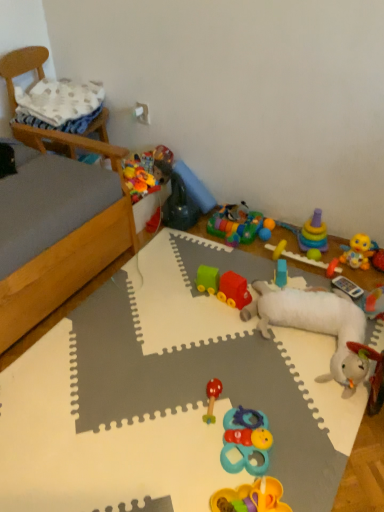
Question: Is white plush sheep at center, the 8th toy viewed from the top, at the back of rubberized plastic train at center, which is counted as the 4th toy, starting from the bottom?

Choices:
 (A) yes
 (B) no

Answer: (B)

Question: Is rubberized plastic train at center, the 7th toy when ordered from top to bottom, oriented towards white plush sheep at center, the third toy ordered from the bottom?

Choices:
 (A) no
 (B) yes

Answer: (B)

Question: Considering the relative sizes of rubberized plastic train at center, which is counted as the 4th toy, starting from the bottom, and white plush sheep at center, the 8th toy viewed from the top, in the image provided, is rubberized plastic train at center, which is counted as the 4th toy, starting from the bottom, smaller than white plush sheep at center, the 8th toy viewed from the top,?

Choices:
 (A) yes
 (B) no

Answer: (A)

Question: Is rubberized plastic train at center, which is counted as the 4th toy, starting from the bottom, to the left of white plush sheep at center, the third toy ordered from the bottom, from the viewer's perspective?

Choices:
 (A) no
 (B) yes

Answer: (B)

Question: Is rubberized plastic train at center, the 7th toy when ordered from top to bottom, far from white plush sheep at center, the 8th toy viewed from the top?

Choices:
 (A) no
 (B) yes

Answer: (A)

Question: In terms of height, does green rubber ball at upper right, arranged as the 7th toy when ordered from the bottom, look taller or shorter compared to wooden bed frame at left?

Choices:
 (A) short
 (B) tall

Answer: (A)

Question: Considering their positions, is green rubber ball at upper right, arranged as the 7th toy when ordered from the bottom, located in front of or behind wooden bed frame at left?

Choices:
 (A) behind
 (B) front

Answer: (A)

Question: From a real-world perspective, relative to wooden bed frame at left, is green rubber ball at upper right, the fourth toy from the top, vertically above or below?

Choices:
 (A) above
 (B) below

Answer: (B)

Question: Is green rubber ball at upper right, the fourth toy from the top, wider or thinner than wooden bed frame at left?

Choices:
 (A) thin
 (B) wide

Answer: (A)

Question: Is green rubber ball at upper right, arranged as the 7th toy when ordered from the bottom, in front of or behind rubberized plastic train at center, which is counted as the 4th toy, starting from the bottom, in the image?

Choices:
 (A) behind
 (B) front

Answer: (A)

Question: Which is correct: green rubber ball at upper right, arranged as the 7th toy when ordered from the bottom, is inside rubberized plastic train at center, which is counted as the 4th toy, starting from the bottom, or outside of it?

Choices:
 (A) inside
 (B) outside

Answer: (B)

Question: Considering the positions of green rubber ball at upper right, the fourth toy from the top, and rubberized plastic train at center, which is counted as the 4th toy, starting from the bottom, in the image, is green rubber ball at upper right, the fourth toy from the top, wider or thinner than rubberized plastic train at center, which is counted as the 4th toy, starting from the bottom,?

Choices:
 (A) wide
 (B) thin

Answer: (B)

Question: From the image's perspective, is green rubber ball at upper right, arranged as the 7th toy when ordered from the bottom, above or below rubberized plastic train at center, which is counted as the 4th toy, starting from the bottom?

Choices:
 (A) below
 (B) above

Answer: (B)

Question: From a real-world perspective, is blue plastic toy at center, which appears as the fifth toy when ordered from the bottom, positioned above or below wooden chair at upper left?

Choices:
 (A) above
 (B) below

Answer: (B)

Question: In terms of height, does blue plastic toy at center, which appears as the fifth toy when ordered from the bottom, look taller or shorter compared to wooden chair at upper left?

Choices:
 (A) short
 (B) tall

Answer: (A)